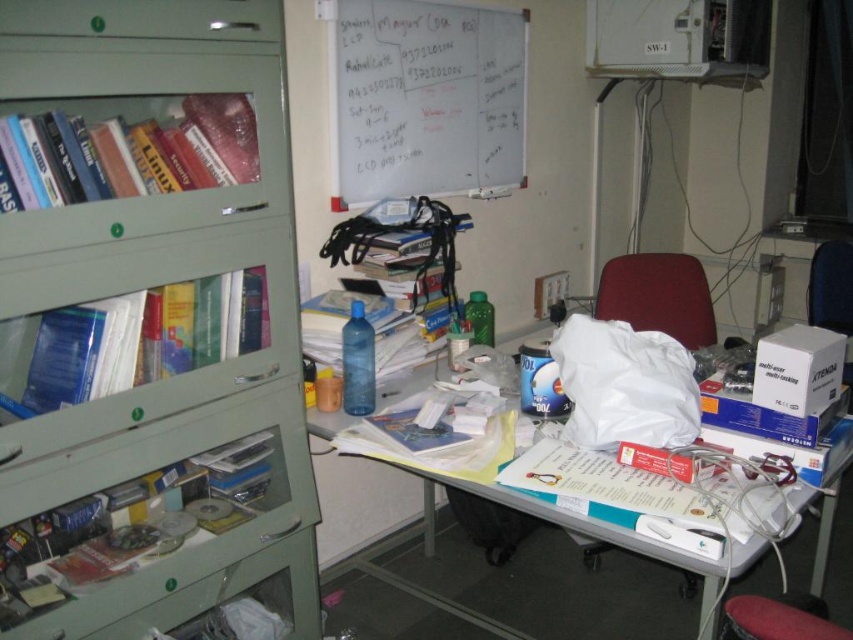
Question: Among these points, which one is nearest to the camera?

Choices:
 (A) (395, 68)
 (B) (239, 468)
 (C) (233, 324)

Answer: (C)

Question: Is whiteboard at upper center further to camera compared to velvet-like maroon chair at center?

Choices:
 (A) no
 (B) yes

Answer: (A)

Question: Which point is closer to the camera?

Choices:
 (A) (344, 109)
 (B) (708, 604)

Answer: (B)

Question: Among these objects, which one is nearest to the camera?

Choices:
 (A) metallic silver cd at left
 (B) whiteboard at upper center
 (C) hardcover books at left

Answer: (C)

Question: Is whiteboard at upper center to the left of hardcover books at left from the viewer's perspective?

Choices:
 (A) yes
 (B) no

Answer: (B)

Question: Is the position of green matte bookshelf at left more distant than that of whiteboard at upper center?

Choices:
 (A) yes
 (B) no

Answer: (B)